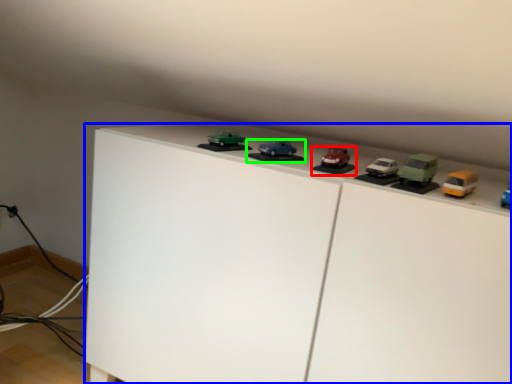
Question: Considering the real-world distances, which object is farthest from toy (highlighted by a red box)? furniture (highlighted by a blue box) or toy (highlighted by a green box)?

Choices:
 (A) furniture
 (B) toy

Answer: (A)